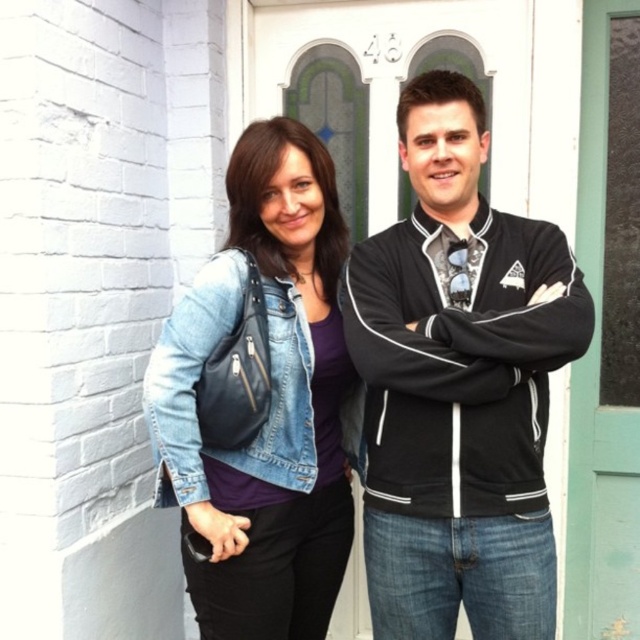
Can you confirm if black fleece jacket at right is positioned below denim jacket at center?

Incorrect, black fleece jacket at right is not positioned below denim jacket at center.

Which of these two, black fleece jacket at right or denim jacket at center, stands taller?

With more height is black fleece jacket at right.

Looking at this image, who is more distant from viewer, [452,538] or [188,464]?

Positioned behind is point [452,538].

In order to click on black fleece jacket at right in this screenshot , I will do `click(458, 385)`.

Is point (472, 252) farther from viewer compared to point (184, 358)?

Yes.

Does black fleece jacket at right have a greater width compared to denim jacket at lower left?

Correct, the width of black fleece jacket at right exceeds that of denim jacket at lower left.

Describe the element at coordinates (458, 385) in the screenshot. I see `black fleece jacket at right` at that location.

What are the coordinates of `black fleece jacket at right` in the screenshot? It's located at (458, 385).

Between denim jacket at center and denim jacket at lower left, which one is positioned higher?

denim jacket at lower left is higher up.

Between denim jacket at center and denim jacket at lower left, which one appears on the right side from the viewer's perspective?

denim jacket at center

Between point (336, 420) and point (160, 353), which one is positioned in front?

Point (160, 353) is more forward.

At what (x,y) coordinates should I click in order to perform the action: click on denim jacket at center. Please return your answer as a coordinate pair (x, y). Looking at the image, I should click on (269, 403).